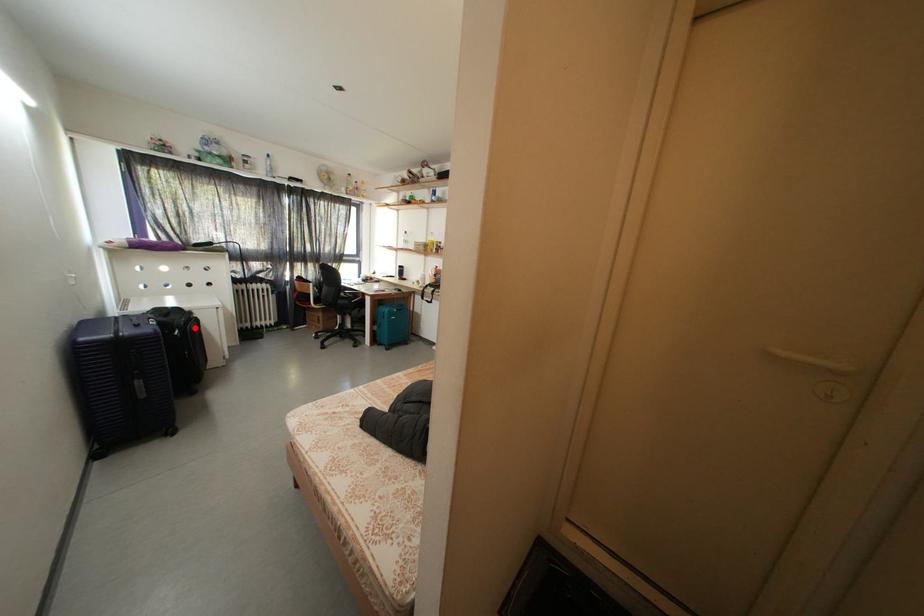
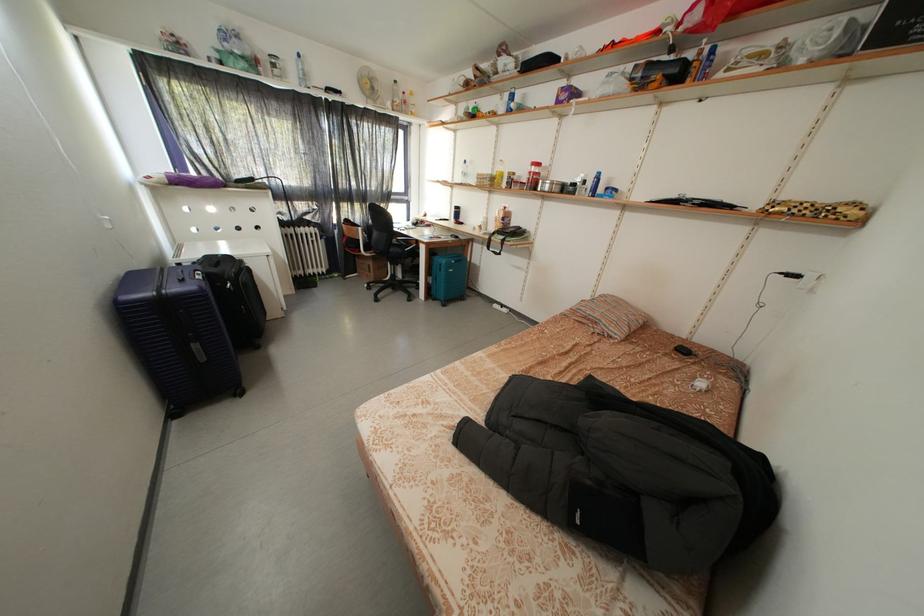
Find the pixel in the second image that matches the highlighted location in the first image.

(246, 280)